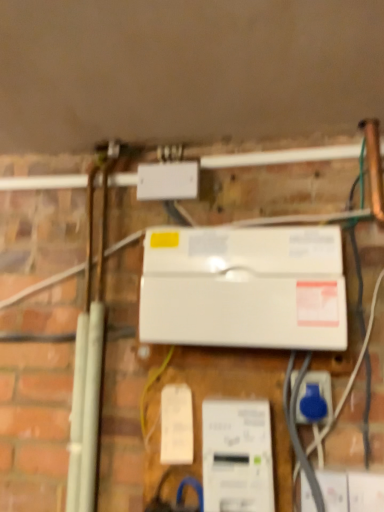
The width and height of the screenshot is (384, 512). Describe the element at coordinates (314, 398) in the screenshot. I see `blue rubber plug at lower right` at that location.

Locate an element on the screen. The width and height of the screenshot is (384, 512). blue rubber plug at lower right is located at coordinates (314, 398).

The height and width of the screenshot is (512, 384). I want to click on blue rubber plug at lower right, so click(314, 398).